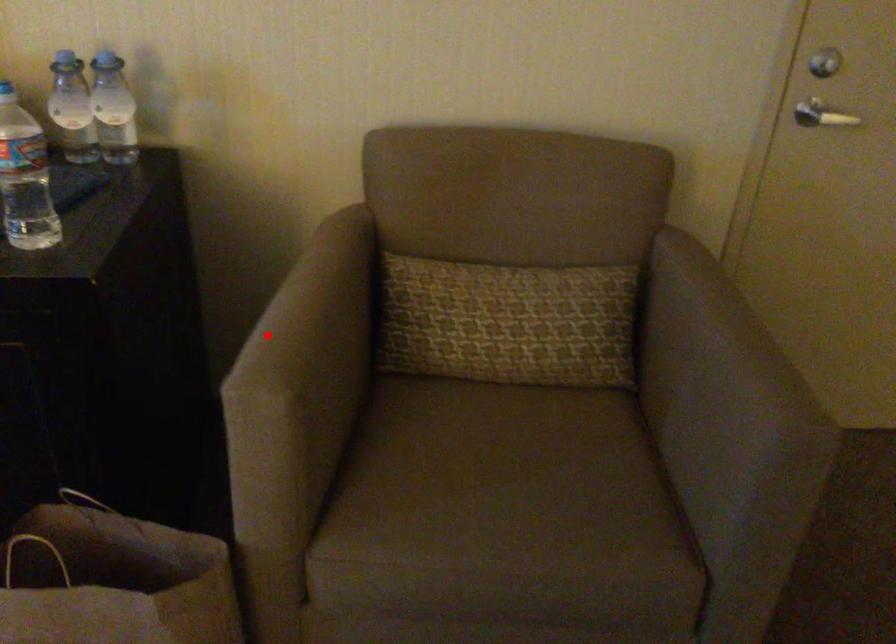
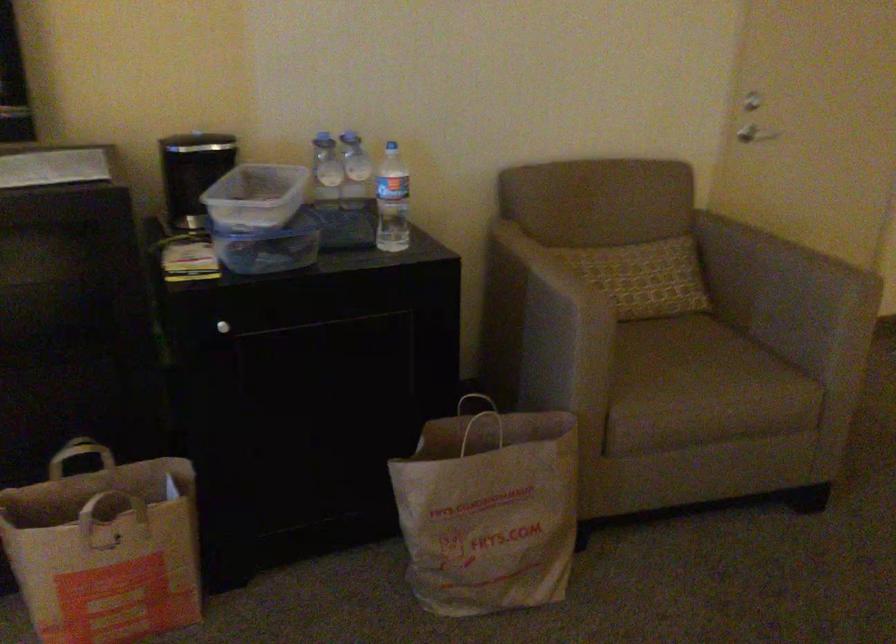
Locate, in the second image, the point that corresponds to the highlighted location in the first image.

(552, 281)